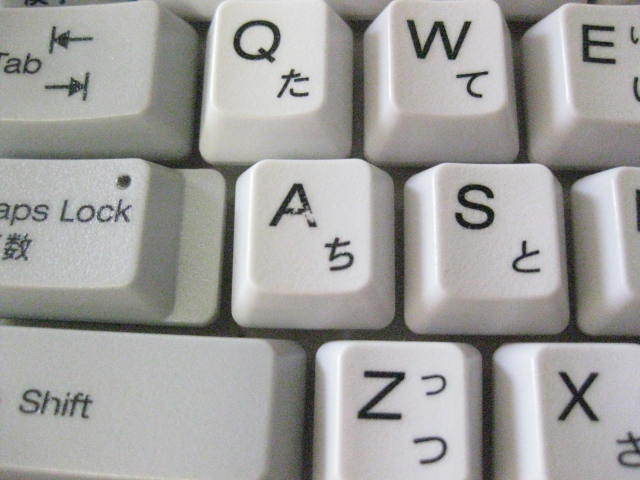
Identify the location of keyboard. (296, 98).